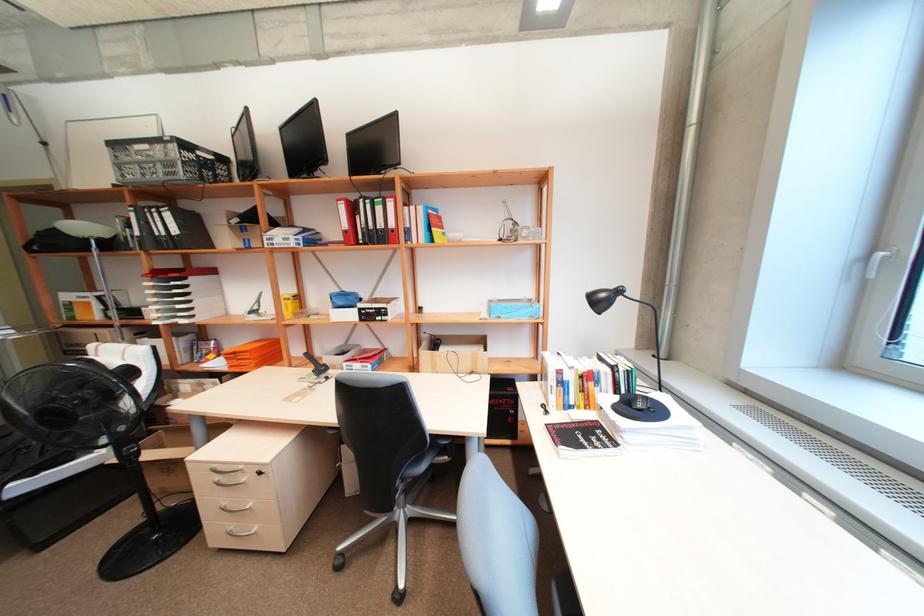
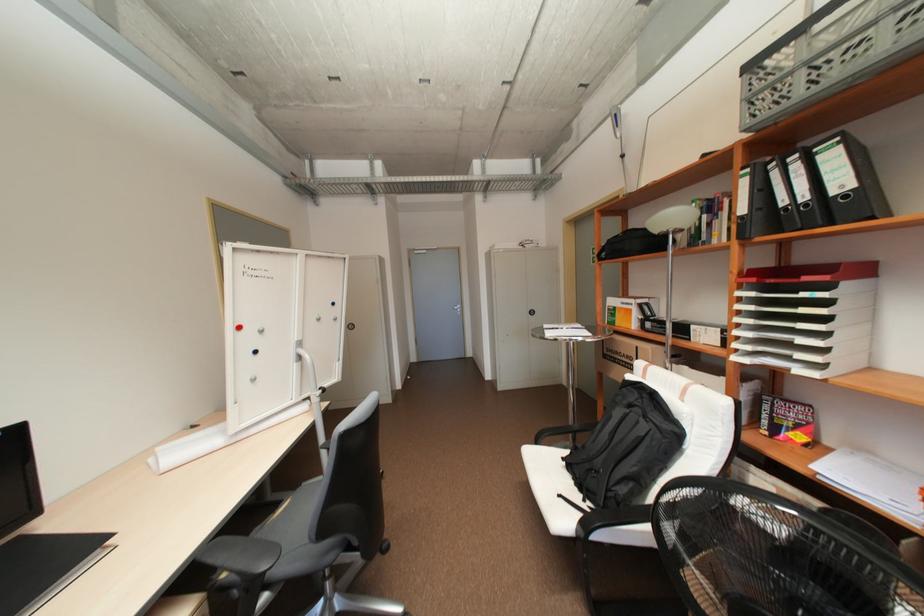
The point at (x=161, y=323) is marked in the first image. Where is the corresponding point in the second image?

(742, 358)